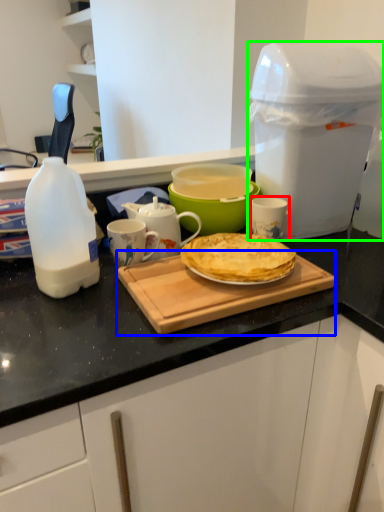
Question: Based on their relative distances, which object is farther from mug (highlighted by a red box)? Choose from cutting board (highlighted by a blue box) and appliance (highlighted by a green box).

Choices:
 (A) cutting board
 (B) appliance

Answer: (A)